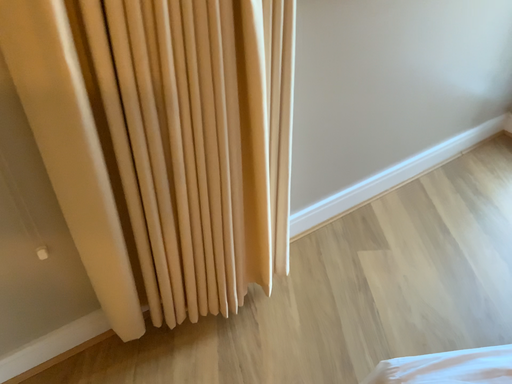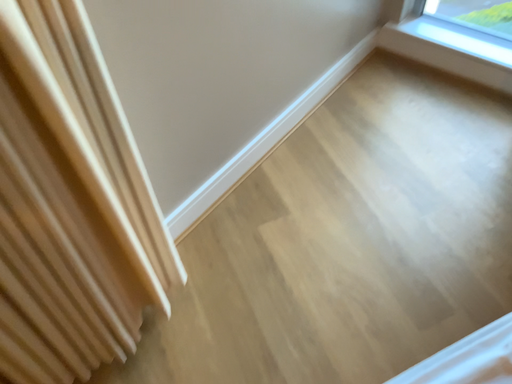
Question: How did the camera likely rotate when shooting the video?

Choices:
 (A) rotated upward
 (B) rotated downward

Answer: (B)